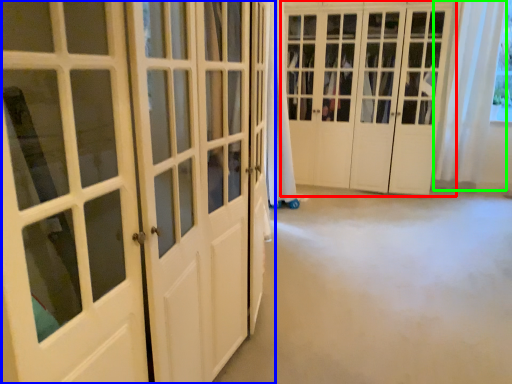
Question: Which is farther away from door (highlighted by a red box)? door (highlighted by a blue box) or curtain (highlighted by a green box)?

Choices:
 (A) door
 (B) curtain

Answer: (A)